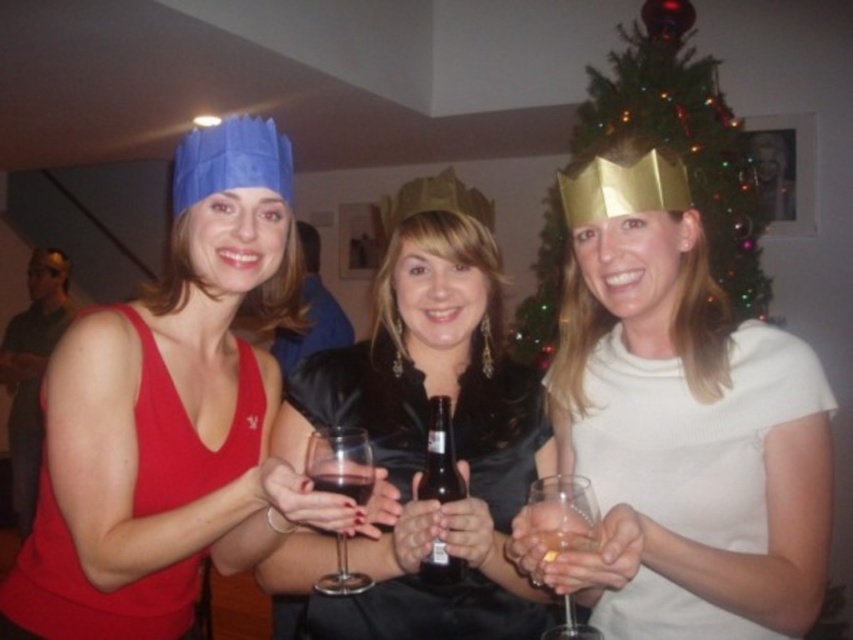
Question: Where is green shiny christmas tree at upper center located in relation to translucent glass at center in the image?

Choices:
 (A) right
 (B) left

Answer: (A)

Question: Which point is farther to the camera?

Choices:
 (A) (527, 557)
 (B) (647, 65)
 (C) (409, 516)

Answer: (B)

Question: Which point is closer to the camera taking this photo?

Choices:
 (A) (554, 554)
 (B) (32, 618)
 (C) (573, 554)
 (D) (631, 131)

Answer: (C)

Question: Observing the image, what is the correct spatial positioning of gold paper crown at upper center in reference to green shiny christmas tree at upper center?

Choices:
 (A) right
 (B) left

Answer: (B)

Question: Is gold paper crown at upper center above brown glass bottle at center?

Choices:
 (A) yes
 (B) no

Answer: (A)

Question: Considering the real-world distances, which object is farthest from the green shiny christmas tree at upper center?

Choices:
 (A) clear glass wine glass at center
 (B) matte blue paper crown at left

Answer: (A)